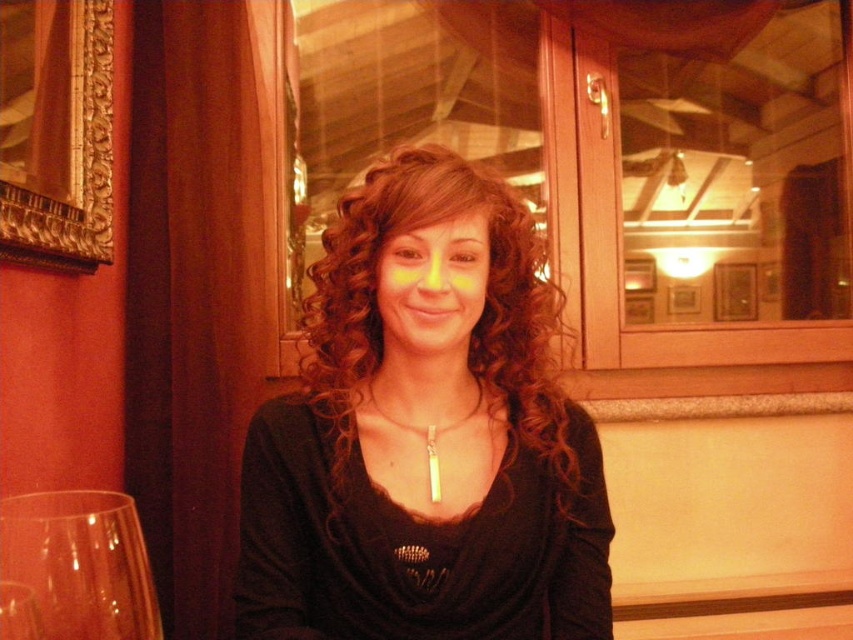
Is matte black shirt at center smaller than transparent glass at lower left?

No, matte black shirt at center is not smaller than transparent glass at lower left.

Is point (485, 472) positioned after point (131, 513)?

That is True.

Is point (302, 444) farther from viewer compared to point (122, 580)?

Yes.

Find the location of `matte black shirt at center`. matte black shirt at center is located at coordinates (425, 435).